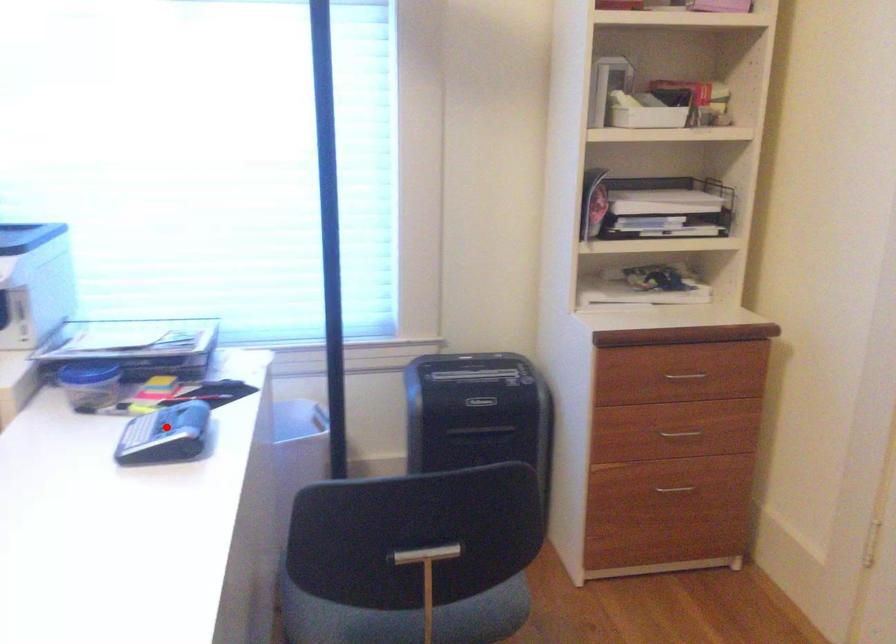
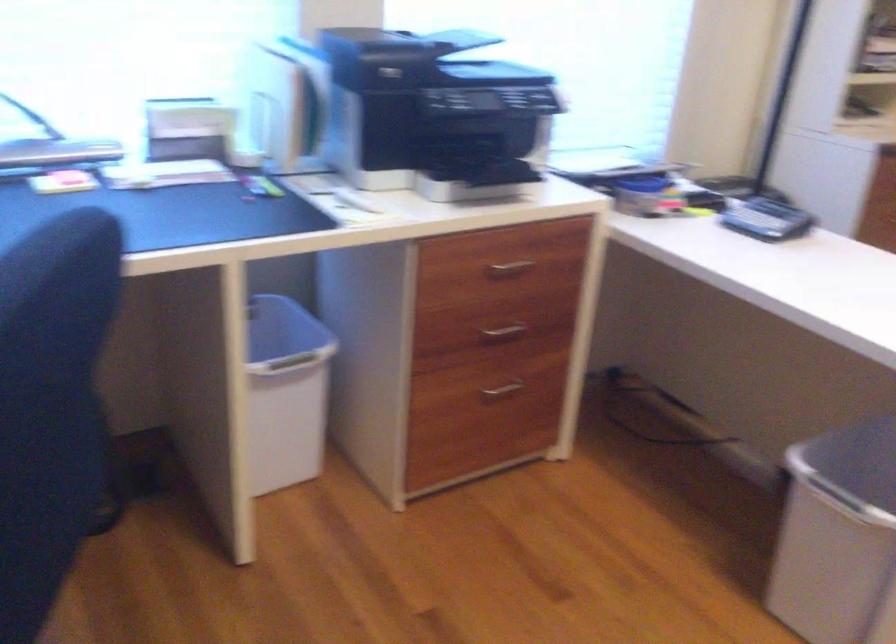
The point at the highlighted location is marked in the first image. Where is the corresponding point in the second image?

(767, 220)